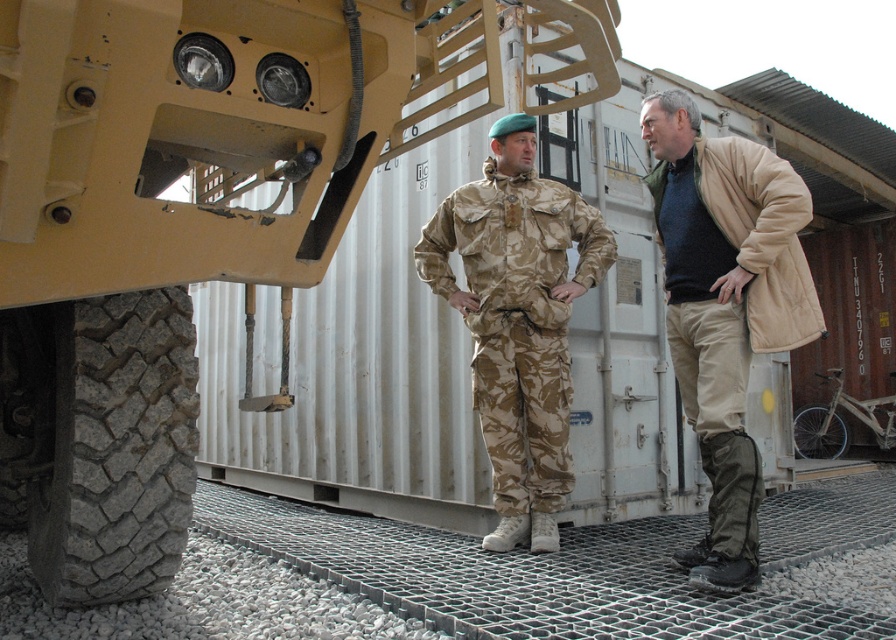
You are a photographer trying to capture a closeup of the beige fleece jacket at right. Based on its position coordinates, where should you aim your camera?

The beige fleece jacket at right is located at point 0.481 on the x axis and 0.810 on the y axis, so aim your camera towards those coordinates for the best shot.

What are the coordinates of the camouflage fabric uniform at center?

The camouflage fabric uniform at center is located at coordinates point (518, 320).

You are a delivery person who needs to load a package onto the white matte bicycle at lower right. There is a beige fleece jacket at right in your way. Which object should you move first to access the bicycle?

You should move the beige fleece jacket at right first because it is blocking the path to the white matte bicycle at lower right, as the beige fleece jacket at right is positioned to the left of the bicycle.